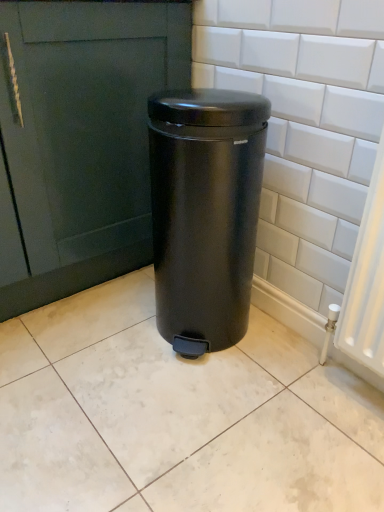
Question: Can you confirm if matte black trash can at center is positioned to the right of white glossy ceramic tile at center?

Choices:
 (A) yes
 (B) no

Answer: (A)

Question: From the image's perspective, is matte black trash can at center below white glossy ceramic tile at center?

Choices:
 (A) yes
 (B) no

Answer: (B)

Question: Is matte black trash can at center thinner than white glossy ceramic tile at center?

Choices:
 (A) yes
 (B) no

Answer: (A)

Question: Is the depth of matte black trash can at center greater than that of white glossy ceramic tile at center?

Choices:
 (A) no
 (B) yes

Answer: (B)

Question: Is matte black trash can at center closer to the viewer compared to white glossy ceramic tile at center?

Choices:
 (A) no
 (B) yes

Answer: (A)

Question: From a real-world perspective, is matte black trash can at center positioned over white glossy ceramic tile at center based on gravity?

Choices:
 (A) no
 (B) yes

Answer: (B)

Question: From a real-world perspective, is white glossy ceramic tile at center physically above matte black trash can at center?

Choices:
 (A) no
 (B) yes

Answer: (A)

Question: Can you confirm if white glossy ceramic tile at center is bigger than matte black trash can at center?

Choices:
 (A) no
 (B) yes

Answer: (A)

Question: From the image's perspective, is white glossy ceramic tile at center located above matte black trash can at center?

Choices:
 (A) no
 (B) yes

Answer: (A)

Question: Does white glossy ceramic tile at center come behind matte black trash can at center?

Choices:
 (A) no
 (B) yes

Answer: (A)

Question: From a real-world perspective, is white glossy ceramic tile at center positioned under matte black trash can at center based on gravity?

Choices:
 (A) yes
 (B) no

Answer: (A)

Question: From the image's perspective, is white glossy ceramic tile at center under matte black trash can at center?

Choices:
 (A) no
 (B) yes

Answer: (B)

Question: Is matte black trash can at center wider or thinner than white glossy ceramic tile at center?

Choices:
 (A) wide
 (B) thin

Answer: (B)